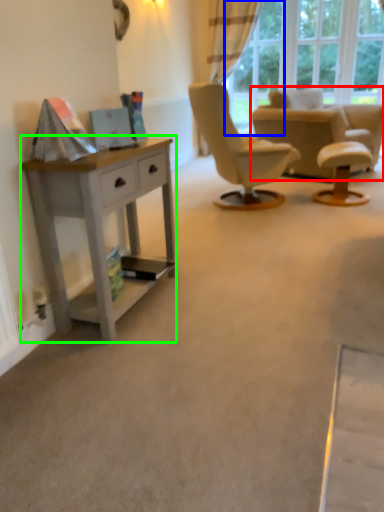
Question: Which object is positioned farthest from chair (highlighted by a red box)? Select from glass door (highlighted by a blue box) and desk (highlighted by a green box).

Choices:
 (A) glass door
 (B) desk

Answer: (B)